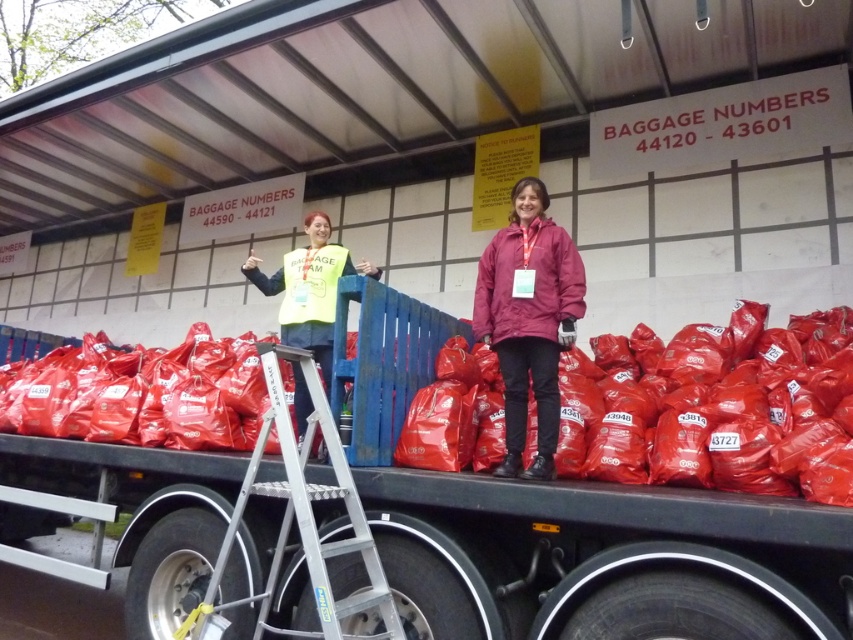
You are a worker on the truck bed and need to locate the yellow reflective vest at center and the rubberized plastic bags at center. Which object is higher from the ground?

The yellow reflective vest at center is higher than the rubberized plastic bags at center because the rubberized plastic bags at center is below it.

You are a worker at the event and need to place a new yellow reflective vest at center on the truck bed. Given the current arrangement, will the rubberized plastic bags at center block the vest from being visible from the front of the truck bed?

The rubberized plastic bags at center are taller than the yellow reflective vest at center, so they will block the vest from being visible from the front of the truck bed.

You are a worker at the event and need to retrieve a bag from the truck. You see the rubberized plastic bags at center and the matte maroon jacket at center. Which object is positioned to the left of the other?

The rubberized plastic bags at center are to the left of the matte maroon jacket at center.